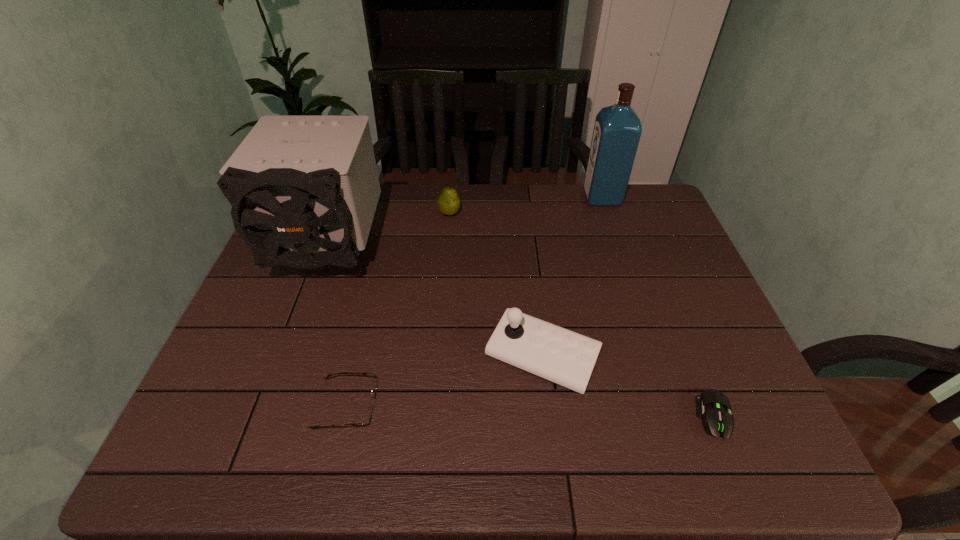
This screenshot has width=960, height=540. Find the location of `free region at the far right corner`. free region at the far right corner is located at coordinates (648, 187).

Image resolution: width=960 pixels, height=540 pixels. I want to click on vacant space at the near right corner of the desktop, so click(x=718, y=462).

I want to click on free space between the shortest object and the third object from left to right, so click(x=583, y=315).

Locate an element on the screen. vacant space that is in between the pear and the joystick is located at coordinates (495, 285).

The height and width of the screenshot is (540, 960). I want to click on empty location between the fan and the liquor, so click(x=466, y=225).

At what (x,y) coordinates should I click in order to perform the action: click on empty location between the fourth tallest object and the liquor. Please return your answer as a coordinate pair (x, y). Looking at the image, I should click on (525, 205).

You are a GUI agent. You are given a task and a screenshot of the screen. Output one action in this format:
    pyautogui.click(x=<x>, y=<y>)
    Task: Click on the free space between the fourth object from left to right and the shortest object
    This screenshot has width=960, height=540.
    Given the screenshot: What is the action you would take?
    pyautogui.click(x=629, y=386)

Where is `vacant point located between the fifth tallest object and the third object from right to left`? This screenshot has height=540, width=960. vacant point located between the fifth tallest object and the third object from right to left is located at coordinates (444, 381).

You are a GUI agent. You are given a task and a screenshot of the screen. Output one action in this format:
    pyautogui.click(x=<x>, y=<y>)
    Task: Click on the vacant space in between the fourth tallest object and the fan
    The width and height of the screenshot is (960, 540).
    Given the screenshot: What is the action you would take?
    pyautogui.click(x=390, y=233)

Locate an element on the screen. empty location between the joystick and the second shortest object is located at coordinates (444, 381).